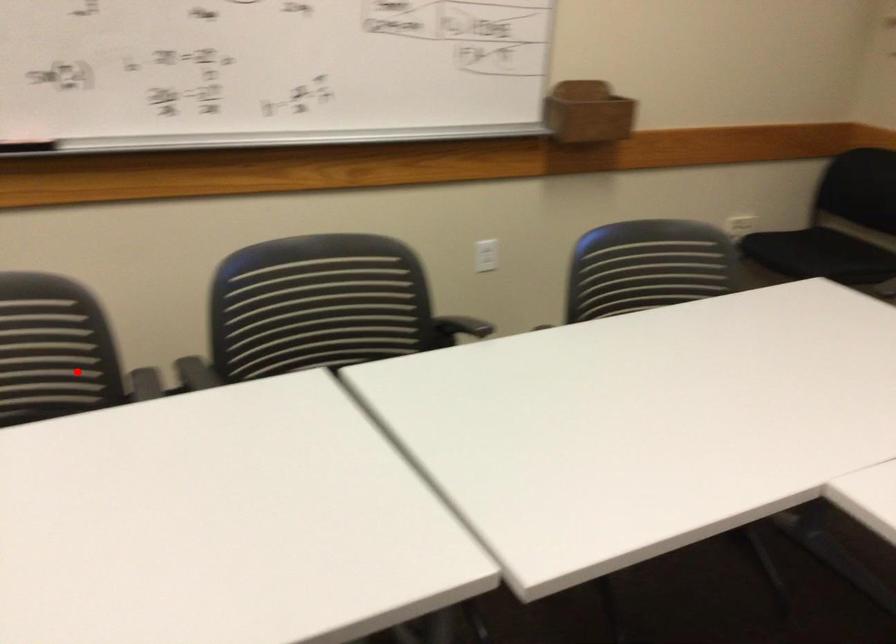
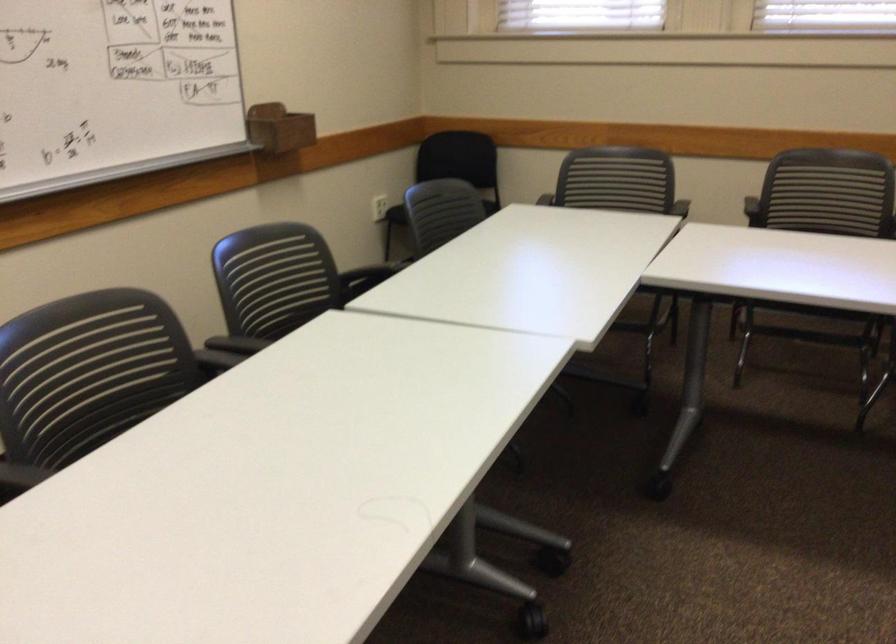
Locate, in the second image, the point that corresponds to the highlighted location in the first image.

(125, 375)